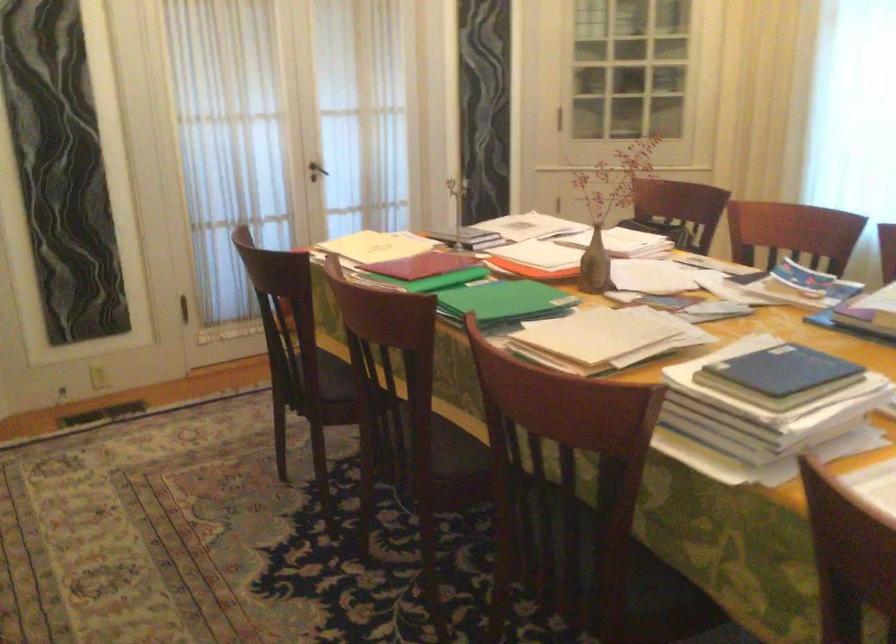
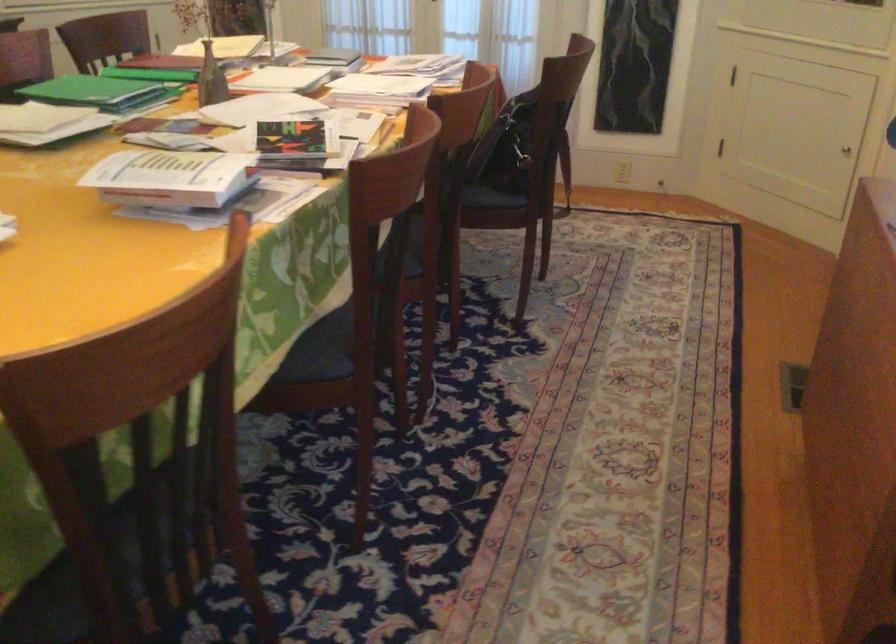
Locate, in the second image, the point that corresponds to the point at 540,308 in the first image.

(99, 91)